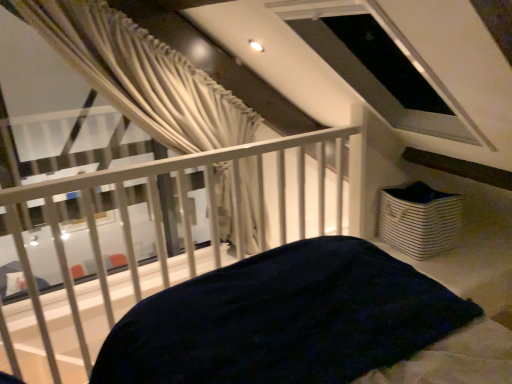
Identify the location of white striped fabric basket at lower right. (418, 219).

Describe the element at coordinates (418, 219) in the screenshot. This screenshot has height=384, width=512. I see `white striped fabric basket at lower right` at that location.

Image resolution: width=512 pixels, height=384 pixels. Describe the element at coordinates (165, 235) in the screenshot. I see `white metal railing at upper center` at that location.

Where is `white metal railing at upper center`? white metal railing at upper center is located at coordinates (165, 235).

Where is `white striped fabric basket at lower right`? white striped fabric basket at lower right is located at coordinates (418, 219).

Which object is positioned more to the left, white striped fabric basket at lower right or white metal railing at upper center?

white metal railing at upper center.

Who is more distant, white striped fabric basket at lower right or white metal railing at upper center?

white striped fabric basket at lower right is behind.

Which point is more distant from viewer, (449, 228) or (301, 141)?

The point (449, 228) is farther from the camera.

Consider the image. From the image's perspective, which object appears higher, white striped fabric basket at lower right or white metal railing at upper center?

white striped fabric basket at lower right appears higher in the image.

From a real-world perspective, is white striped fabric basket at lower right physically below white metal railing at upper center?

Yes, from a real-world perspective, white striped fabric basket at lower right is under white metal railing at upper center.

Between white striped fabric basket at lower right and white metal railing at upper center, which one has smaller width?

Thinner between the two is white striped fabric basket at lower right.

Between white striped fabric basket at lower right and white metal railing at upper center, which one has more height?

white metal railing at upper center is taller.

Can you confirm if white striped fabric basket at lower right is bigger than white metal railing at upper center?

Actually, white striped fabric basket at lower right might be smaller than white metal railing at upper center.

In the scene shown: Is white metal railing at upper center located within white striped fabric basket at lower right?

No.

Is white striped fabric basket at lower right next to white metal railing at upper center?

No, white striped fabric basket at lower right is not in contact with white metal railing at upper center.

Is white striped fabric basket at lower right turned away from white metal railing at upper center?

No, white striped fabric basket at lower right is not facing away from white metal railing at upper center.

How many degrees apart are the facing directions of white striped fabric basket at lower right and white metal railing at upper center?

white striped fabric basket at lower right and white metal railing at upper center are facing 175 degrees away from each other.

The image size is (512, 384). I want to click on basket above the white metal railing at upper center (from the image's perspective), so click(x=418, y=219).

Which object is positioned more to the left, white metal railing at upper center or white striped fabric basket at lower right?

white metal railing at upper center is more to the left.

Is white metal railing at upper center in front of white striped fabric basket at lower right?

Yes, it is in front of white striped fabric basket at lower right.

Does point (59, 212) appear closer or farther from the camera than point (450, 195)?

Clearly, point (59, 212) is more distant from the camera than point (450, 195).

Looking at this image, from the image's perspective, is white metal railing at upper center above or below white striped fabric basket at lower right?

Clearly, from the image's perspective, white metal railing at upper center is below white striped fabric basket at lower right.

Based on the photo, from a real-world perspective, is white metal railing at upper center positioned over white striped fabric basket at lower right based on gravity?

Yes, from a real-world perspective, white metal railing at upper center is above white striped fabric basket at lower right.

Can you confirm if white metal railing at upper center is wider than white striped fabric basket at lower right?

Yes.

Considering the relative sizes of white metal railing at upper center and white striped fabric basket at lower right in the image provided, is white metal railing at upper center shorter than white striped fabric basket at lower right?

No, white metal railing at upper center is not shorter than white striped fabric basket at lower right.

Between white metal railing at upper center and white striped fabric basket at lower right, which one has larger size?

white metal railing at upper center.

From the picture: Is white striped fabric basket at lower right surrounded by white metal railing at upper center?

No, white metal railing at upper center does not contain white striped fabric basket at lower right.

Are white metal railing at upper center and white striped fabric basket at lower right making contact?

There is a gap between white metal railing at upper center and white striped fabric basket at lower right.

Does white metal railing at upper center turn towards white striped fabric basket at lower right?

No.

Where is `balcony that appears in front of the white striped fabric basket at lower right`? This screenshot has width=512, height=384. balcony that appears in front of the white striped fabric basket at lower right is located at coordinates (165, 235).

Where is `basket below the white metal railing at upper center (from a real-world perspective)`? The height and width of the screenshot is (384, 512). basket below the white metal railing at upper center (from a real-world perspective) is located at coordinates (418, 219).

Find the location of a particular element. The height and width of the screenshot is (384, 512). basket that is on the right side of white metal railing at upper center is located at coordinates (418, 219).